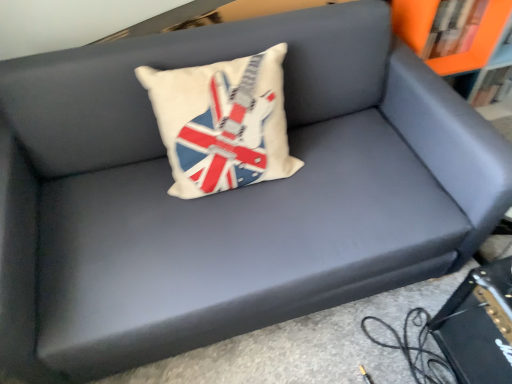
What do you see at coordinates (222, 122) in the screenshot? I see `white fabric pillow with union jack design at center` at bounding box center [222, 122].

What is the approximate width of black leather book at lower right?

black leather book at lower right is 12.18 inches wide.

The width and height of the screenshot is (512, 384). What do you see at coordinates (479, 325) in the screenshot?
I see `black leather book at lower right` at bounding box center [479, 325].

Identify the location of orange matte bookshelf at upper right. The width and height of the screenshot is (512, 384). pos(454,27).

Locate an element on the screen. This screenshot has width=512, height=384. white fabric pillow with union jack design at center is located at coordinates (222, 122).

You are a GUI agent. You are given a task and a screenshot of the screen. Output one action in this format:
    pyautogui.click(x=<x>, y=<y>)
    Task: Click on the bookcase below the white fabric pillow with union jack design at center (from a real-world perspective)
    
    Given the screenshot: What is the action you would take?
    pyautogui.click(x=463, y=46)

From a real-world perspective, is orange matte bookcase at upper right positioned over white fabric pillow with union jack design at center based on gravity?

No, from a real-world perspective, orange matte bookcase at upper right is not on top of white fabric pillow with union jack design at center.

Which object is positioned more to the left, orange matte bookcase at upper right or white fabric pillow with union jack design at center?

white fabric pillow with union jack design at center is more to the left.

Can you tell me how much orange matte bookcase at upper right and white fabric pillow with union jack design at center differ in facing direction?

orange matte bookcase at upper right and white fabric pillow with union jack design at center are facing 0.919 degrees away from each other.

Can you tell me how much white fabric pillow with union jack design at center and orange matte bookcase at upper right differ in facing direction?

0.919 degrees.

Can you confirm if white fabric pillow with union jack design at center is positioned to the left of orange matte bookcase at upper right?

Indeed, white fabric pillow with union jack design at center is positioned on the left side of orange matte bookcase at upper right.

Is point (188, 82) closer to viewer compared to point (479, 18)?

Yes, point (188, 82) is in front of point (479, 18).

Which is in front, orange matte bookcase at upper right or orange matte bookshelf at upper right?

orange matte bookcase at upper right is closer to the camera.

Who is shorter, orange matte bookcase at upper right or orange matte bookshelf at upper right?

With less height is orange matte bookshelf at upper right.

Where is `book on the left of orange matte bookcase at upper right`? The height and width of the screenshot is (384, 512). book on the left of orange matte bookcase at upper right is located at coordinates (454, 27).

Is orange matte bookcase at upper right far away from orange matte bookshelf at upper right?

No, orange matte bookcase at upper right is not far away from orange matte bookshelf at upper right.

Could white fabric pillow with union jack design at center be considered to be inside orange matte bookshelf at upper right?

No, orange matte bookshelf at upper right does not contain white fabric pillow with union jack design at center.

Does orange matte bookshelf at upper right have a greater width compared to white fabric pillow with union jack design at center?

Incorrect, the width of orange matte bookshelf at upper right does not surpass that of white fabric pillow with union jack design at center.

Is orange matte bookshelf at upper right oriented away from white fabric pillow with union jack design at center?

No, orange matte bookshelf at upper right is not facing away from white fabric pillow with union jack design at center.

From a real-world perspective, is orange matte bookshelf at upper right positioned over white fabric pillow with union jack design at center based on gravity?

Actually, orange matte bookshelf at upper right is physically below white fabric pillow with union jack design at center in the real world.

Would you say black leather book at lower right contains white fabric pillow with union jack design at center?

No.

At what (x,y) coordinates should I click in order to perform the action: click on pillow lying behind the black leather book at lower right. Please return your answer as a coordinate pair (x, y). Looking at the image, I should click on (222, 122).

Is point (492, 317) closer to camera compared to point (151, 94)?

Yes, point (492, 317) is in front of point (151, 94).

From the image's perspective, which one is positioned higher, black leather book at lower right or white fabric pillow with union jack design at center?

white fabric pillow with union jack design at center, from the image's perspective.

From a real-world perspective, which object stands above the other?

From a 3D spatial view, white fabric pillow with union jack design at center is above.

Is point (247, 91) closer to viewer compared to point (481, 366)?

Yes, it is in front of point (481, 366).

Based on the photo, does white fabric pillow with union jack design at center have a larger size compared to black leather book at lower right?

Yes.

From the picture: Is white fabric pillow with union jack design at center with black leather book at lower right?

There is a gap between white fabric pillow with union jack design at center and black leather book at lower right.

Does point (493, 365) come behind point (462, 23)?

No, (493, 365) is closer to viewer.

The width and height of the screenshot is (512, 384). Identify the location of paperback book below the orange matte bookshelf at upper right (from the image's perspective). (479, 325).

How many degrees apart are the facing directions of black leather book at lower right and orange matte bookshelf at upper right?

The angular difference between black leather book at lower right and orange matte bookshelf at upper right is 91.9 degrees.

From the image's perspective, is black leather book at lower right located beneath orange matte bookshelf at upper right?

Correct, black leather book at lower right appears lower than orange matte bookshelf at upper right in the image.

Identify the location of bookcase located underneath the white fabric pillow with union jack design at center (from a real-world perspective). (463, 46).

Find the location of a particular element. Image resolution: width=512 pixels, height=384 pixels. bookcase that is above the white fabric pillow with union jack design at center (from the image's perspective) is located at coordinates (463, 46).

From the image, which object appears to be farther from white fabric pillow with union jack design at center, black leather book at lower right or orange matte bookcase at upper right?

orange matte bookcase at upper right is positioned further to the anchor white fabric pillow with union jack design at center.

Estimate the real-world distances between objects in this image. Which object is closer to black leather book at lower right, white fabric pillow with union jack design at center or orange matte bookcase at upper right?

white fabric pillow with union jack design at center is positioned closer to the anchor black leather book at lower right.

From the image, which object appears to be farther from white fabric pillow with union jack design at center, black leather book at lower right or orange matte bookshelf at upper right?

orange matte bookshelf at upper right lies further to white fabric pillow with union jack design at center than the other object.

Looking at the image, which one is located closer to white fabric pillow with union jack design at center, orange matte bookcase at upper right or orange matte bookshelf at upper right?

orange matte bookshelf at upper right lies closer to white fabric pillow with union jack design at center than the other object.

When comparing their distances from black leather book at lower right, does orange matte bookcase at upper right or white fabric pillow with union jack design at center seem further?

orange matte bookcase at upper right is further to black leather book at lower right.

Which object lies further to the anchor point orange matte bookshelf at upper right, white fabric pillow with union jack design at center or black leather book at lower right?

black leather book at lower right is further to orange matte bookshelf at upper right.

Estimate the real-world distances between objects in this image. Which object is further from white fabric pillow with union jack design at center, orange matte bookshelf at upper right or black leather book at lower right?

The object further to white fabric pillow with union jack design at center is orange matte bookshelf at upper right.

Estimate the real-world distances between objects in this image. Which object is closer to orange matte bookcase at upper right, white fabric pillow with union jack design at center or orange matte bookshelf at upper right?

orange matte bookshelf at upper right is positioned closer to the anchor orange matte bookcase at upper right.

The width and height of the screenshot is (512, 384). What are the coordinates of `pillow between orange matte bookshelf at upper right and black leather book at lower right vertically` in the screenshot? It's located at (222, 122).

Identify the location of book located between white fabric pillow with union jack design at center and orange matte bookcase at upper right in the left-right direction. The image size is (512, 384). (454, 27).

At what (x,y) coordinates should I click in order to perform the action: click on bookcase between orange matte bookshelf at upper right and black leather book at lower right from top to bottom. Please return your answer as a coordinate pair (x, y). The image size is (512, 384). Looking at the image, I should click on (463, 46).

Locate an element on the screen. paperback book located between white fabric pillow with union jack design at center and orange matte bookcase at upper right in the left-right direction is located at coordinates (479, 325).